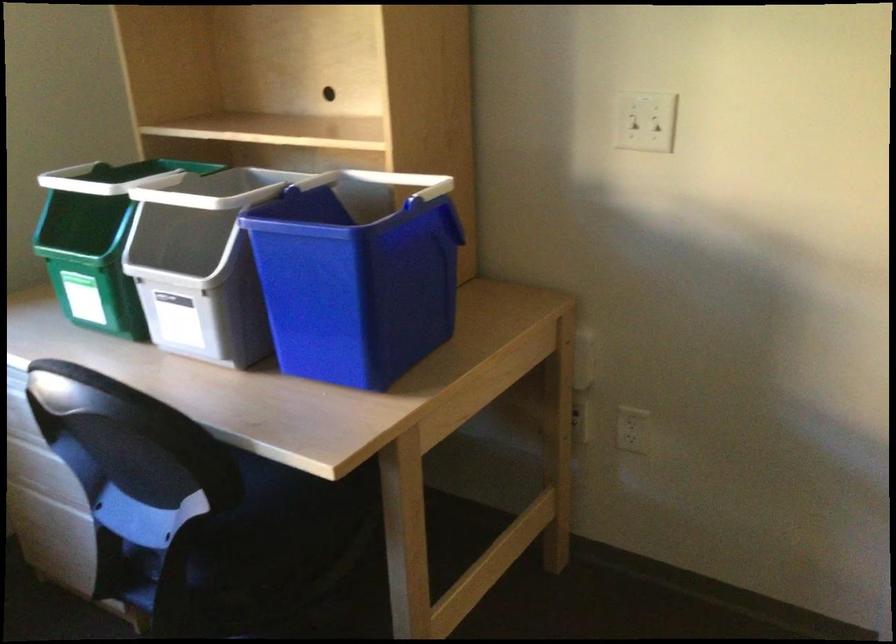
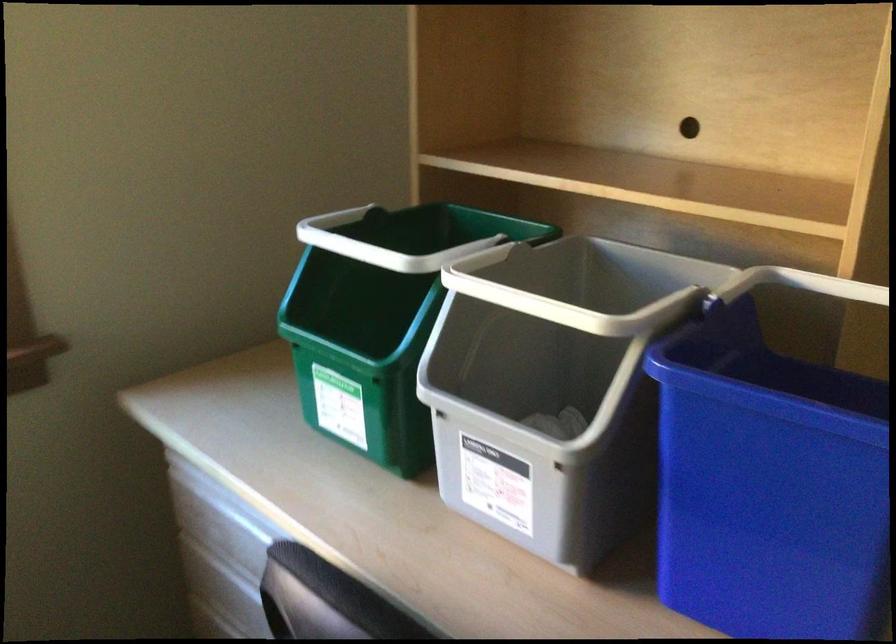
Question: Based on the continuous images, in which direction is the camera rotating? Reply with the corresponding letter.

Choices:
 (A) Left
 (B) Right
 (C) Up
 (D) Down

Answer: (A)